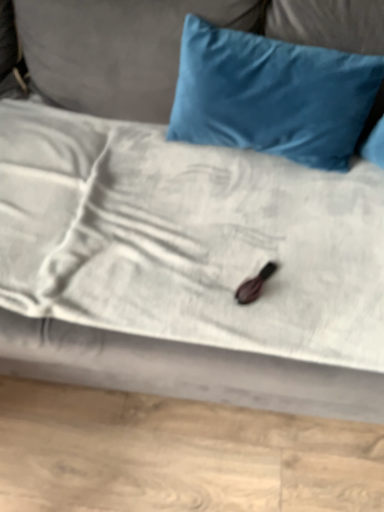
What is the approximate width of velvet blue pillow at upper right?

The width of velvet blue pillow at upper right is 16.76 centimeters.

This screenshot has height=512, width=384. Find the location of `velvet blue pillow at upper right`. velvet blue pillow at upper right is located at coordinates (277, 97).

In order to face velvet blue pillow at upper right, should I rotate leftwards or rightwards?

Rotate your view right by about 9.600°.

What do you see at coordinates (277, 97) in the screenshot? This screenshot has width=384, height=512. I see `velvet blue pillow at upper right` at bounding box center [277, 97].

Locate an element on the screen. The width and height of the screenshot is (384, 512). velvet blue pillow at upper right is located at coordinates (277, 97).